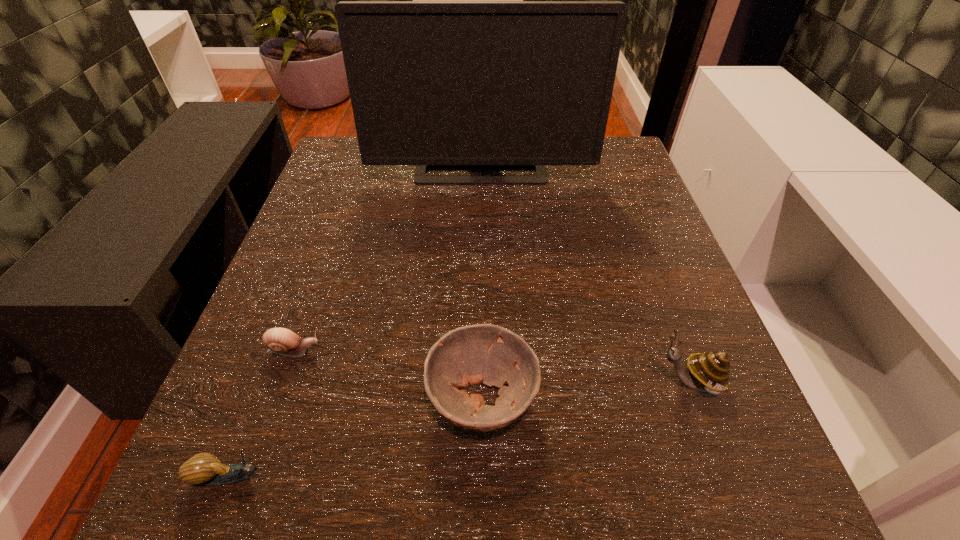
The width and height of the screenshot is (960, 540). In order to click on vacant space at the near right corner in this screenshot , I will do coord(701,464).

What are the coordinates of `free space between the bowl and the second nearest escargot` in the screenshot? It's located at (585, 390).

Locate an element on the screen. Image resolution: width=960 pixels, height=540 pixels. vacant space that's between the nearest escargot and the bowl is located at coordinates (356, 437).

The image size is (960, 540). In order to click on free space between the nearest escargot and the third tallest object in this screenshot , I will do `click(356, 437)`.

Find the location of a particular element. vacant space that is in between the rightmost escargot and the nearest escargot is located at coordinates (459, 429).

Where is `vacant area that lies between the farthest escargot and the bowl`? Image resolution: width=960 pixels, height=540 pixels. vacant area that lies between the farthest escargot and the bowl is located at coordinates (388, 375).

The image size is (960, 540). What are the coordinates of `free spot between the computer monitor and the third shortest object` in the screenshot? It's located at (481, 281).

I want to click on empty location between the farthest escargot and the nearest escargot, so click(262, 413).

You are a GUI agent. You are given a task and a screenshot of the screen. Output one action in this format:
    pyautogui.click(x=<x>, y=<y>)
    Task: Click on the free point between the bowl and the farthest escargot
    Image resolution: width=960 pixels, height=540 pixels.
    Given the screenshot: What is the action you would take?
    pyautogui.click(x=388, y=375)

Where is `vacant space that's between the tallest object and the bowl`? vacant space that's between the tallest object and the bowl is located at coordinates (481, 281).